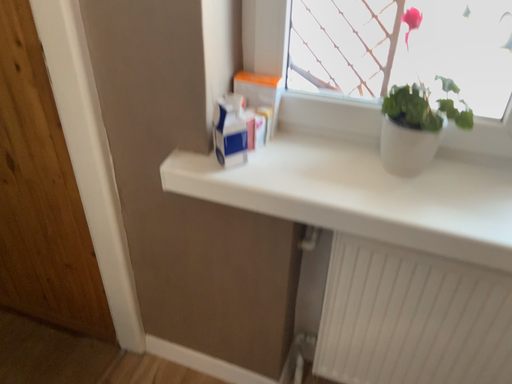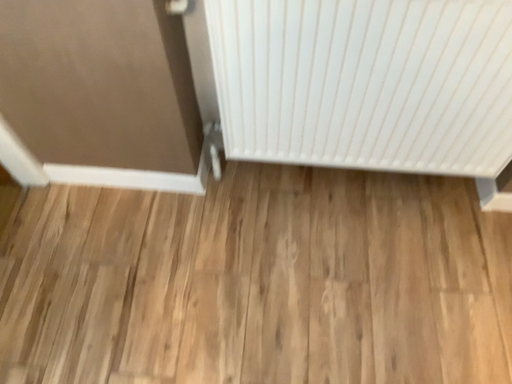
Question: Which way did the camera rotate in the video?

Choices:
 (A) rotated downward
 (B) rotated upward

Answer: (A)